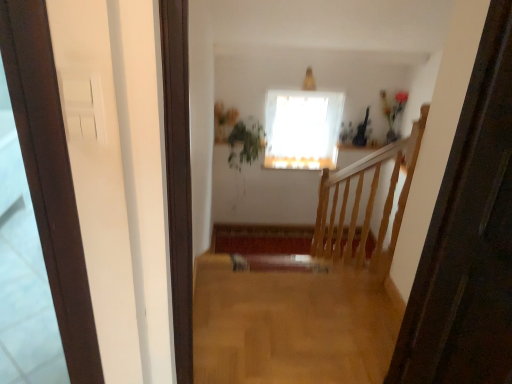
Question: From the image's perspective, is green leafy plant at upper center located above or below light brown wood floor at center?

Choices:
 (A) below
 (B) above

Answer: (B)

Question: Looking at their shapes, would you say green leafy plant at upper center is wider or thinner than light brown wood floor at center?

Choices:
 (A) thin
 (B) wide

Answer: (A)

Question: Which of these objects is positioned farthest from the green leafy plant at upper center?

Choices:
 (A) light brown wood floor at center
 (B) white sheer curtain at upper center

Answer: (A)

Question: Considering the real-world distances, which object is closest to the light brown wood floor at center?

Choices:
 (A) white sheer curtain at upper center
 (B) green leafy plant at upper center

Answer: (A)